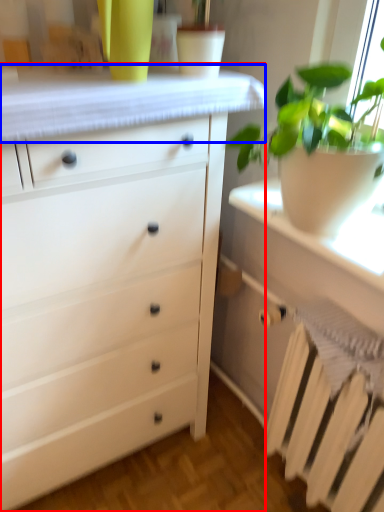
Question: Which object is closer to the camera taking this photo, chest of drawers (highlighted by a red box) or counter top (highlighted by a blue box)?

Choices:
 (A) chest of drawers
 (B) counter top

Answer: (A)